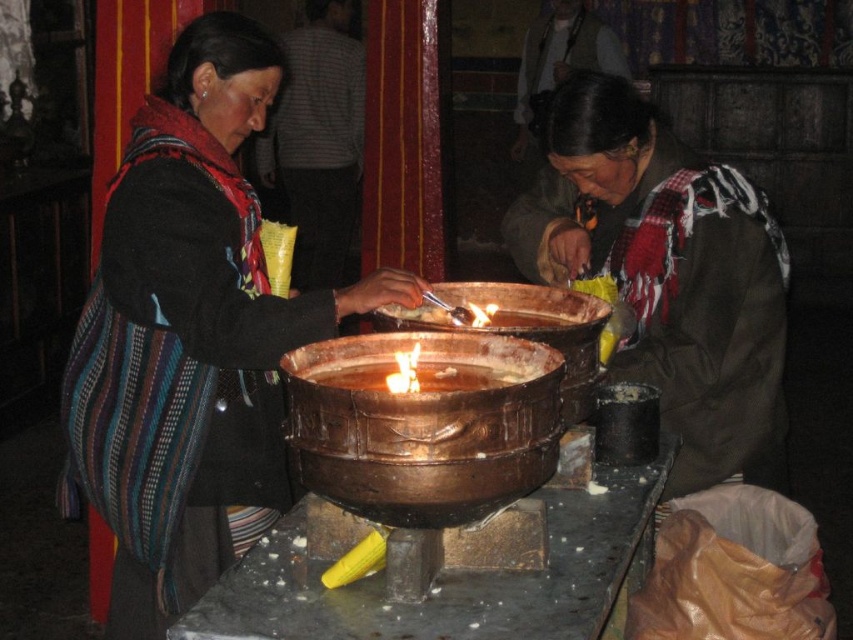
Question: Estimate the real-world distances between objects in this image. Which object is closer to the shiny metallic bowl at center?

Choices:
 (A) matte black jacket at left
 (B) brown textured scarf at lower right

Answer: (A)

Question: Among these objects, which one is farthest from the camera?

Choices:
 (A) shiny metallic bowl at center
 (B) matte black jacket at left
 (C) brown textured scarf at lower right

Answer: (C)

Question: Which of the following is the farthest from the observer?

Choices:
 (A) matte black jacket at left
 (B) shiny metallic bowl at center

Answer: (A)

Question: Is brown textured scarf at lower right below shiny metallic bowl at center?

Choices:
 (A) no
 (B) yes

Answer: (A)

Question: Does matte black jacket at left appear over shiny metallic bowl at center?

Choices:
 (A) yes
 (B) no

Answer: (A)

Question: Is matte black jacket at left wider than brown textured scarf at lower right?

Choices:
 (A) yes
 (B) no

Answer: (A)